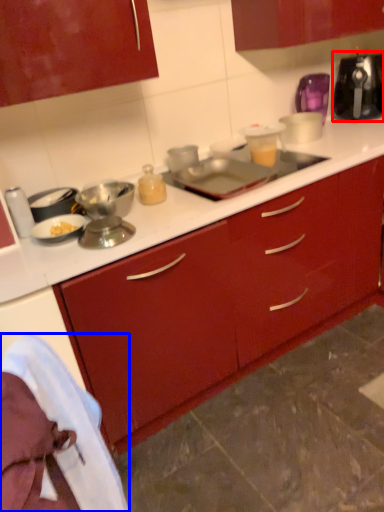
Question: Which object appears farthest to the camera in this image, kitchen appliance (highlighted by a red box) or material (highlighted by a blue box)?

Choices:
 (A) kitchen appliance
 (B) material

Answer: (A)